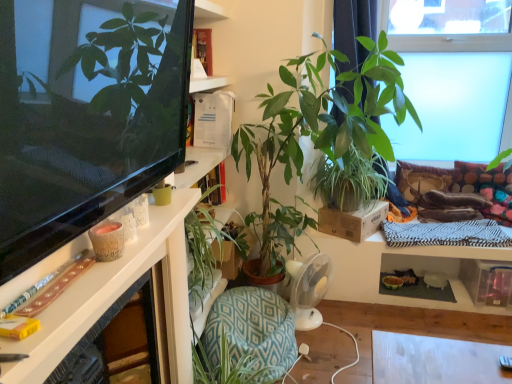
Question: In the image, is white glossy desk at left positioned in front of or behind green leafy plant at center, which appears as the 3th houseplant when viewed from the right?

Choices:
 (A) front
 (B) behind

Answer: (A)

Question: Is point (168, 206) positioned closer to the camera than point (294, 140)?

Choices:
 (A) farther
 (B) closer

Answer: (B)

Question: Considering the real-world distances, which object is farthest from the velvet brown pillow at upper right, the 2th pillow positioned from the right?

Choices:
 (A) multicolored fabric pillow at right, placed as the 2th pillow when sorted from left to right
 (B) green leafy plant at center, which appears as the 3th houseplant when viewed from the right
 (C) green leafy plant at center, which ranks as the third houseplant in left-to-right order
 (D) transparent glass window at upper right
 (E) green leafy plant at center, acting as the 1th houseplant starting from the left

Answer: (E)

Question: Estimate the real-world distances between objects in this image. Which object is farther from the velvet brown pillow at upper right, acting as the first pillow starting from the left?

Choices:
 (A) white glossy desk at left
 (B) multicolored fabric pillow at right, the first pillow positioned from the right
 (C) green leafy plant at upper right, placed as the 4th houseplant when sorted from left to right
 (D) green leafy plant at center, which appears as the 3th houseplant when viewed from the right
 (E) transparent glass window at upper right

Answer: (A)